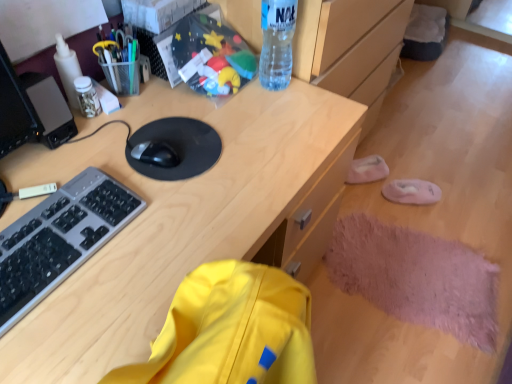
The height and width of the screenshot is (384, 512). Find the location of `vacant space to the left of black matte mouse at center`. vacant space to the left of black matte mouse at center is located at coordinates (87, 149).